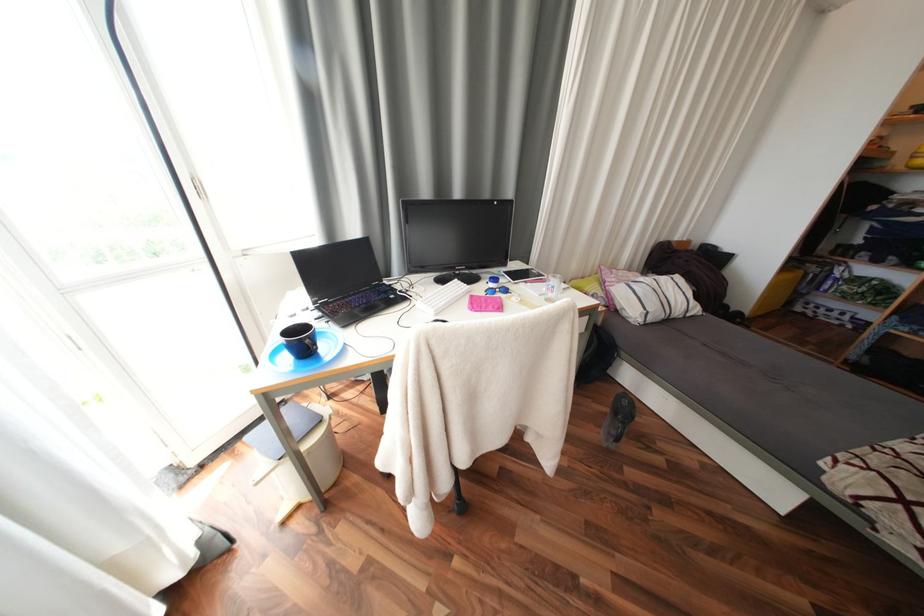
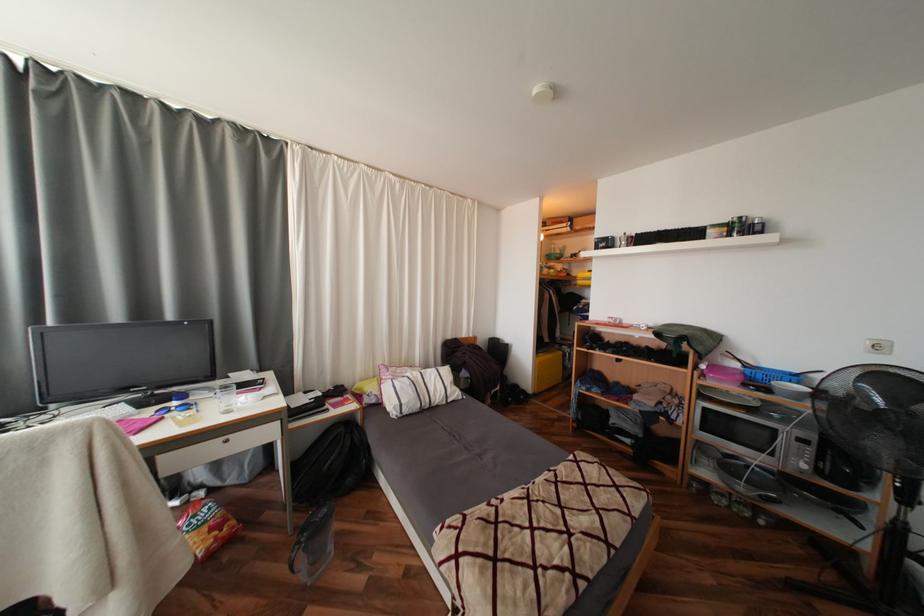
Question: In a continuous first-person perspective shot, in which direction is the camera moving?

Choices:
 (A) Left
 (B) Right
 (C) Forward
 (D) Backward

Answer: (B)